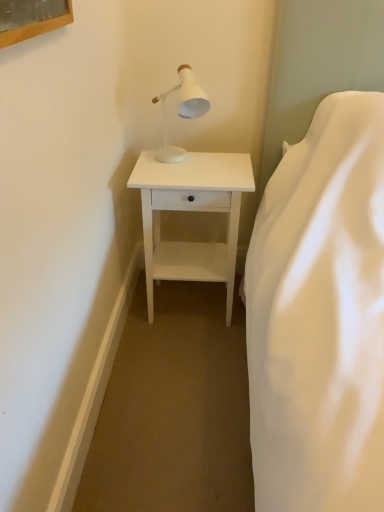
Question: From the image's perspective, is white matte table lamp at upper center above white matte nightstand at lower center?

Choices:
 (A) yes
 (B) no

Answer: (A)

Question: Is white matte nightstand at lower center completely or partially inside white matte table lamp at upper center?

Choices:
 (A) no
 (B) yes

Answer: (A)

Question: Is white matte table lamp at upper center smaller than white matte nightstand at lower center?

Choices:
 (A) no
 (B) yes

Answer: (B)

Question: Is the position of white matte table lamp at upper center less distant than that of white matte nightstand at lower center?

Choices:
 (A) yes
 (B) no

Answer: (A)

Question: From a real-world perspective, is white matte table lamp at upper center on white matte nightstand at lower center?

Choices:
 (A) yes
 (B) no

Answer: (A)

Question: Is white matte table lamp at upper center at the right side of white matte nightstand at lower center?

Choices:
 (A) no
 (B) yes

Answer: (A)

Question: Is white matte nightstand at lower center at the left side of white matte table lamp at upper center?

Choices:
 (A) yes
 (B) no

Answer: (B)

Question: Does white matte nightstand at lower center appear on the right side of white matte table lamp at upper center?

Choices:
 (A) no
 (B) yes

Answer: (B)

Question: Would you say white matte table lamp at upper center is part of white matte nightstand at lower center's contents?

Choices:
 (A) yes
 (B) no

Answer: (B)

Question: From a real-world perspective, is white matte nightstand at lower center physically above white matte table lamp at upper center?

Choices:
 (A) no
 (B) yes

Answer: (A)

Question: From the image's perspective, is white matte nightstand at lower center located above white matte table lamp at upper center?

Choices:
 (A) yes
 (B) no

Answer: (B)

Question: Is white matte nightstand at lower center shorter than white matte table lamp at upper center?

Choices:
 (A) yes
 (B) no

Answer: (B)

Question: Is white matte table lamp at upper center in front of or behind white matte nightstand at lower center in the image?

Choices:
 (A) front
 (B) behind

Answer: (A)